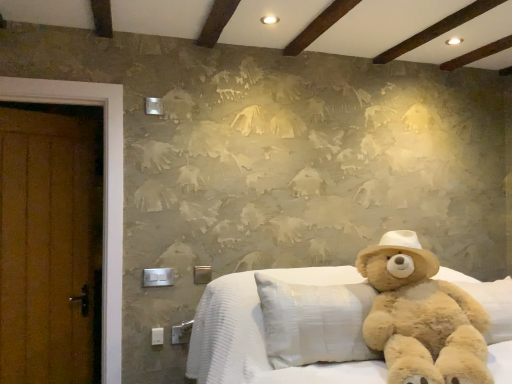
Where is `light brown plush teddy bear at center`? The height and width of the screenshot is (384, 512). light brown plush teddy bear at center is located at coordinates (421, 316).

The height and width of the screenshot is (384, 512). What do you see at coordinates (421, 316) in the screenshot?
I see `light brown plush teddy bear at center` at bounding box center [421, 316].

The image size is (512, 384). Find the location of `light brown plush teddy bear at center`. light brown plush teddy bear at center is located at coordinates (421, 316).